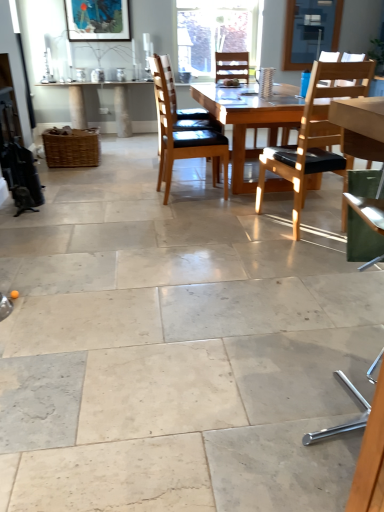
The width and height of the screenshot is (384, 512). Find the location of `free space to the left of green fabric chair at right, which is the second chair in left-to-right order`. free space to the left of green fabric chair at right, which is the second chair in left-to-right order is located at coordinates (248, 419).